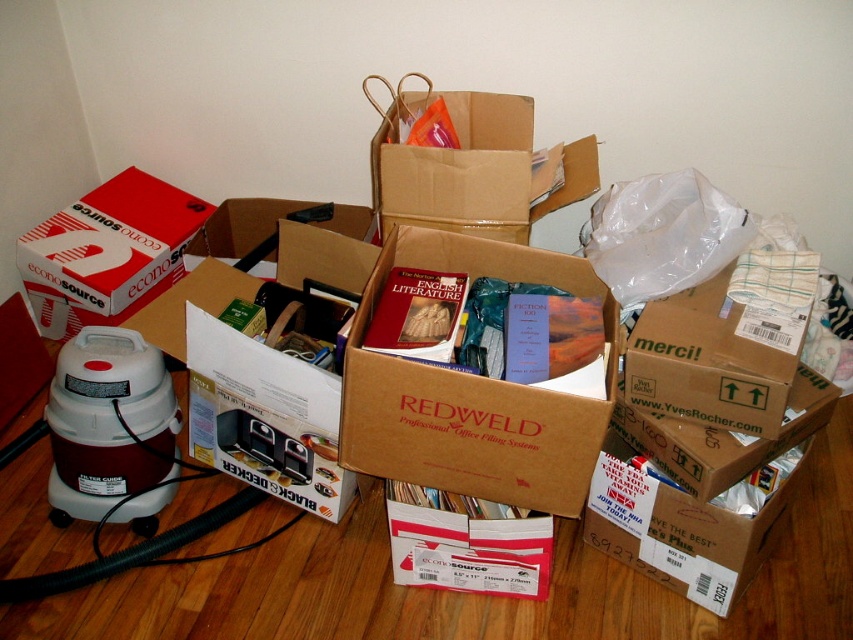
Question: Is brown cardboard box at upper center to the left of red matte cardboard box at left from the viewer's perspective?

Choices:
 (A) yes
 (B) no

Answer: (B)

Question: Is brown cardboard box at upper center positioned at the back of red matte cardboard box at left?

Choices:
 (A) yes
 (B) no

Answer: (B)

Question: Where is brown cardboard box at center located in relation to brown cardboard box at upper center in the image?

Choices:
 (A) right
 (B) left

Answer: (A)

Question: Which object is the closest to the brown cardboard box at upper center?

Choices:
 (A) red matte cardboard box at left
 (B) brown cardboard box at center

Answer: (B)

Question: Among these points, which one is nearest to the camera?

Choices:
 (A) (396, 156)
 (B) (540, 483)
 (C) (70, 259)

Answer: (B)

Question: Which object appears closest to the camera in this image?

Choices:
 (A) brown cardboard box at upper center
 (B) red matte cardboard box at left
 (C) brown cardboard box at center

Answer: (C)